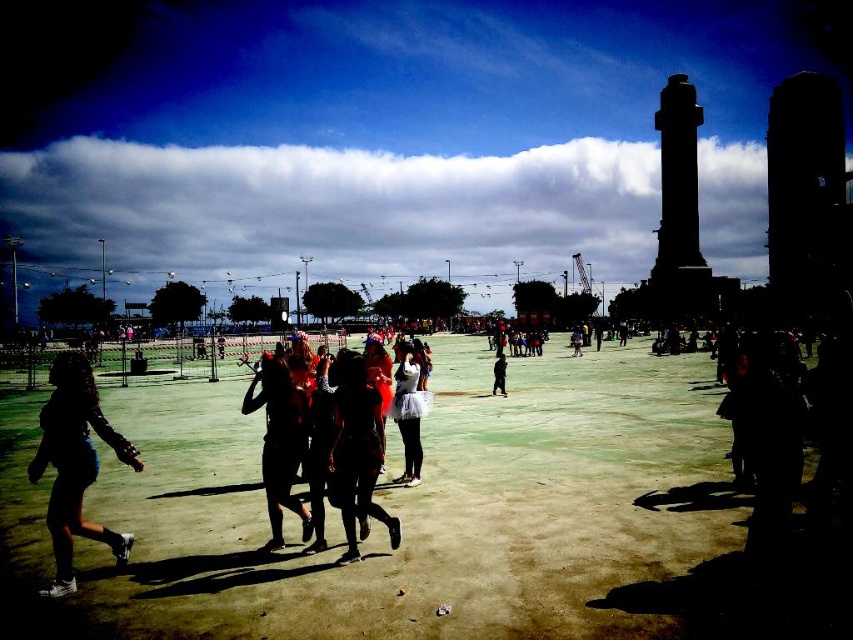
Question: From the image, what is the correct spatial relationship of green grass at center in relation to black fabric dress at center?

Choices:
 (A) below
 (B) above

Answer: (A)

Question: Which object is positioned closest to the white fluffy skirt at center?

Choices:
 (A) black fabric dress at center
 (B) shiny metallic dress at center

Answer: (B)

Question: Which point appears closest to the camera in this image?

Choices:
 (A) (306, 433)
 (B) (363, 499)

Answer: (B)

Question: Which of the following is the closest to the observer?

Choices:
 (A) green grass at center
 (B) matte black dress at center

Answer: (A)

Question: From the image, what is the correct spatial relationship of silhouette fabric at lower left in relation to dark blue jeans at center?

Choices:
 (A) left
 (B) right

Answer: (A)

Question: Does shiny metallic dress at center appear on the left side of matte black dress at center?

Choices:
 (A) no
 (B) yes

Answer: (B)